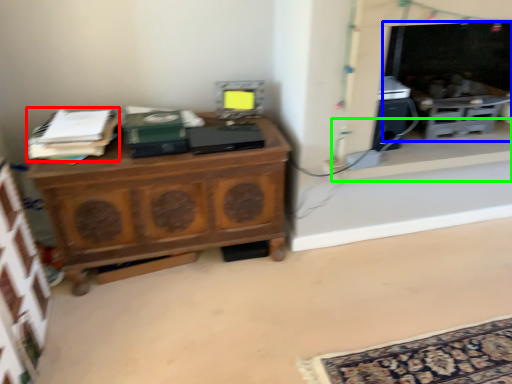
Question: Which object is positioned farthest from book (highlighted by a red box)? Select from fireplace (highlighted by a blue box) and window sill (highlighted by a green box).

Choices:
 (A) fireplace
 (B) window sill

Answer: (A)